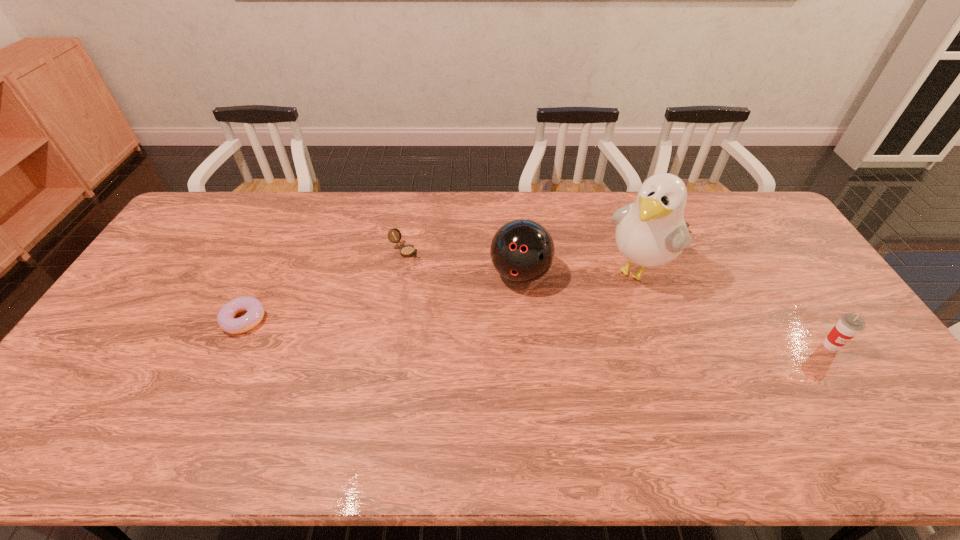
Identify the location of free space between the second object from right to left and the doughnut. The width and height of the screenshot is (960, 540). (442, 294).

You are a GUI agent. You are given a task and a screenshot of the screen. Output one action in this format:
    pyautogui.click(x=<x>, y=<y>)
    Task: Click on the unoccupied position between the bowling ball and the gull
    This screenshot has height=540, width=960.
    Given the screenshot: What is the action you would take?
    pyautogui.click(x=580, y=271)

The image size is (960, 540). I want to click on vacant region between the third object from left to right and the compass, so click(x=463, y=262).

The image size is (960, 540). What are the coordinates of `free space between the cup and the leftmost object` in the screenshot? It's located at (538, 333).

The height and width of the screenshot is (540, 960). In order to click on free point between the leftmost object and the fourth shortest object in this screenshot , I will do `click(382, 296)`.

Where is `vacant region between the cup and the second tallest object`? vacant region between the cup and the second tallest object is located at coordinates (676, 309).

Where is `the fourth closest object relative to the third object from left to right`? the fourth closest object relative to the third object from left to right is located at coordinates (849, 325).

Find the location of a particular element. Image resolution: width=960 pixels, height=540 pixels. the closest object to the second shortest object is located at coordinates (522, 251).

This screenshot has width=960, height=540. Identify the location of vacant space that satisfies the following two spatial constraints: 1. on the back side of the fourth object from left to right; 2. on the left side of the fourth shortest object. (519, 269).

Locate an element on the screen. The height and width of the screenshot is (540, 960). free space that satisfies the following two spatial constraints: 1. on the front side of the tallest object; 2. on the right side of the fourth object from right to left is located at coordinates (401, 269).